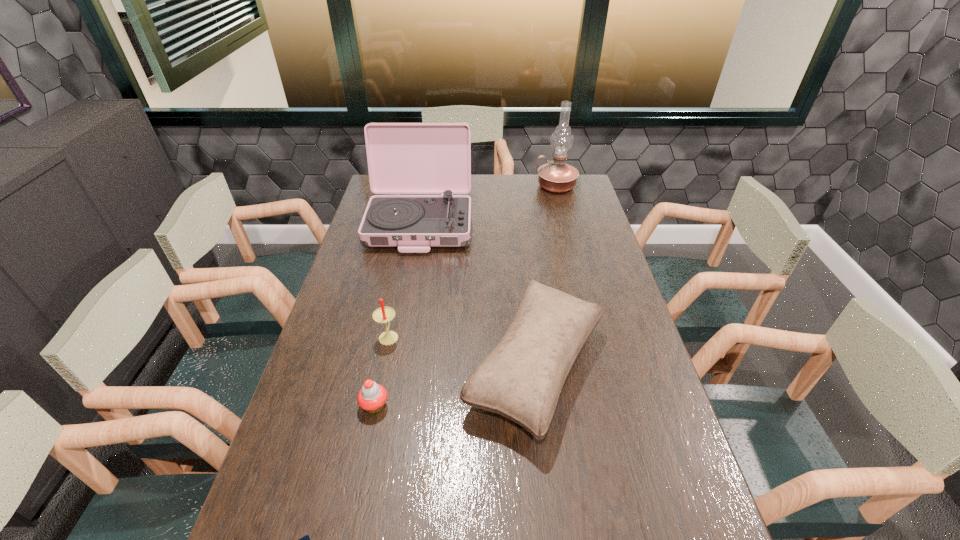
You are a GUI agent. You are given a task and a screenshot of the screen. Output one action in this format:
    pyautogui.click(x=<x>, y=<y>)
    Task: Click on the farthest object
    Image resolution: width=960 pixels, height=540 pixels.
    Given the screenshot: What is the action you would take?
    pyautogui.click(x=556, y=176)

Image resolution: width=960 pixels, height=540 pixels. Identify the location of record player. (403, 158).

Identify the location of candle. (383, 314).

The image size is (960, 540). What are the coordinates of `cushion` in the screenshot? It's located at tap(521, 379).

Find the location of a particular element. The width and height of the screenshot is (960, 540). the fifth tallest object is located at coordinates (372, 396).

Find the location of `vacant space located 0.250m on the front of the oil lamp`. vacant space located 0.250m on the front of the oil lamp is located at coordinates (567, 231).

Identify the location of free space located with the lid open on the second farthest object. Image resolution: width=960 pixels, height=540 pixels. (406, 306).

I want to click on vacant space situated on the front of the candle, so click(x=383, y=366).

At what (x,y) coordinates should I click in order to perform the action: click on free space located on the right of the cushion. Please return your answer as a coordinate pair (x, y). Image resolution: width=960 pixels, height=540 pixels. Looking at the image, I should click on (652, 366).

Locate an element on the screen. This screenshot has height=540, width=960. vacant region located on the right of the fifth tallest object is located at coordinates (528, 406).